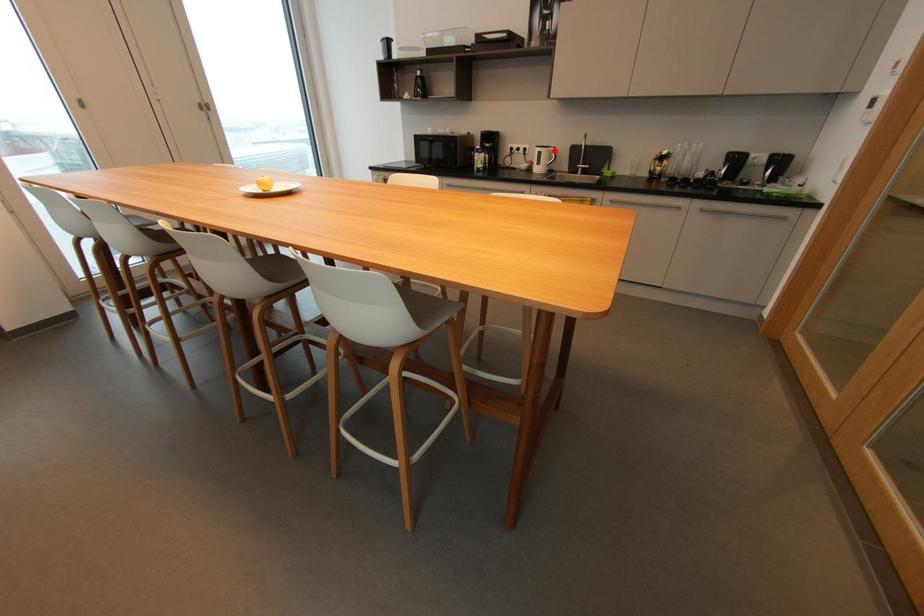
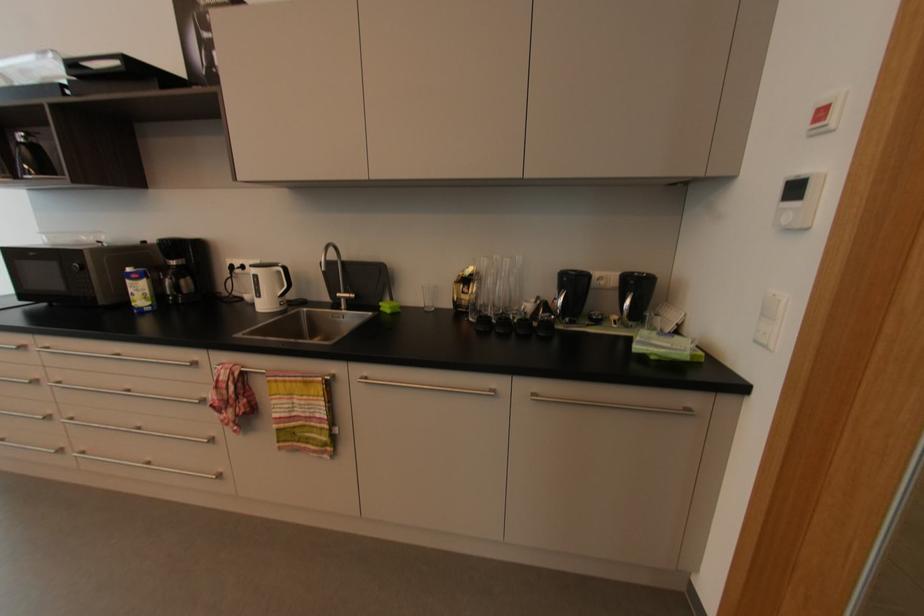
In the second image, find the point that corresponds to the highlighted location in the first image.

(282, 273)